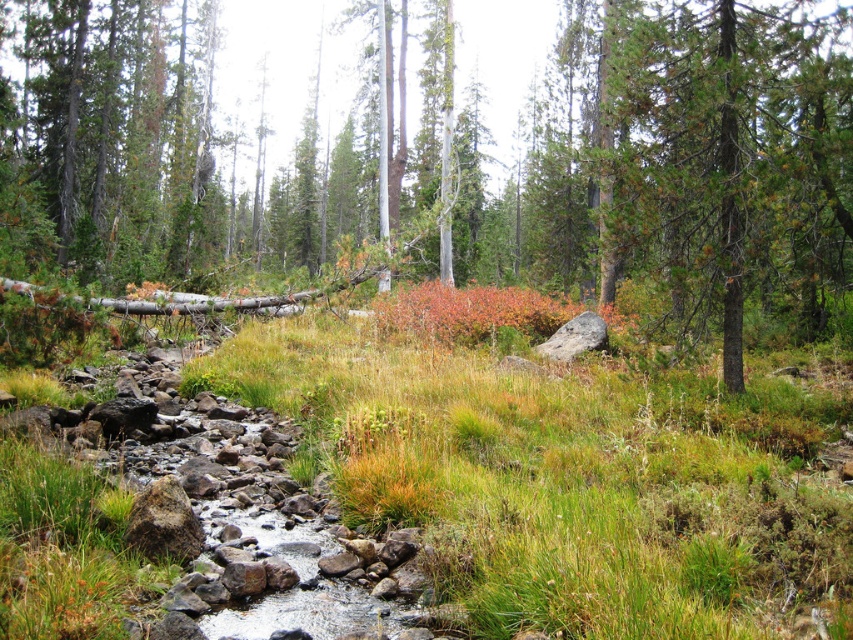
Question: Based on their relative distances, which object is farther from the green grass at center?

Choices:
 (A) green needle-like at center
 (B) green matte tree at center

Answer: (B)

Question: Is green grass at center closer to camera compared to green needle-like at center?

Choices:
 (A) no
 (B) yes

Answer: (B)

Question: Which point appears farthest from the camera in this image?

Choices:
 (A) click(x=851, y=636)
 (B) click(x=131, y=40)

Answer: (B)

Question: Is green matte tree at center below green needle-like at center?

Choices:
 (A) yes
 (B) no

Answer: (B)

Question: Which object is closer to the camera taking this photo?

Choices:
 (A) green needle-like at center
 (B) green grass at center

Answer: (B)

Question: Does green grass at center appear on the left side of green needle-like at center?

Choices:
 (A) no
 (B) yes

Answer: (B)